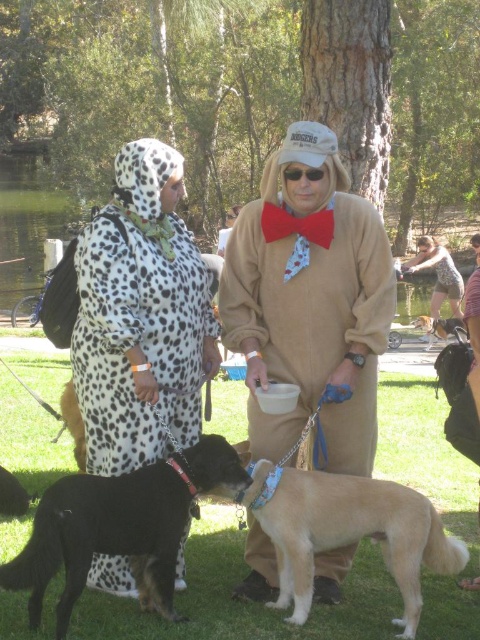
You are a photographer standing at the center of the park. You want to take a photo of both the spotted fabric dress at center and the soft brown fur at center. The minimum distance required for your camera to focus on both subjects clearly is 10 meters. Can you capture both subjects in focus without moving?

The spotted fabric dress at center is 10.02 meters from the soft brown fur at center. Since the minimum focus distance required is 10 meters and the actual distance is slightly over, the camera can focus on both subjects clearly.